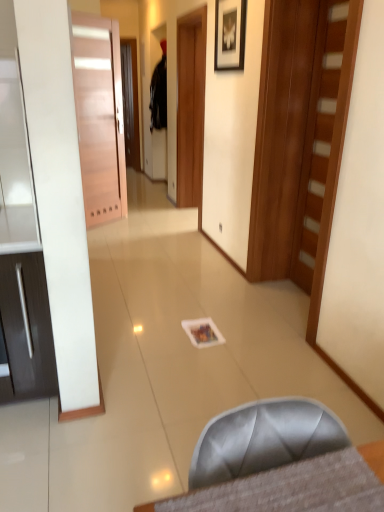
Locate an element on the screen. The width and height of the screenshot is (384, 512). matte pink door at left, placed as the 2th door when sorted from right to left is located at coordinates (99, 116).

Find the location of a particular element. wooden door at right, which is the second door in left-to-right order is located at coordinates point(324,131).

You are a GUI agent. You are given a task and a screenshot of the screen. Output one action in this format:
    pyautogui.click(x=<x>, y=<y>)
    Task: Click on the black fabric robe at upper center
    Image resolution: width=384 pixels, height=512 pixels.
    Given the screenshot: What is the action you would take?
    pyautogui.click(x=159, y=95)

Which is in front, point (244, 13) or point (163, 71)?

The point (244, 13) is more forward.

Is matte black picture frame at upper center in contact with black fabric robe at upper center?

No.

From the picture: Can you confirm if matte black picture frame at upper center is bigger than black fabric robe at upper center?

No.

Between matte black picture frame at upper center and black fabric robe at upper center, which one has smaller width?

matte black picture frame at upper center is thinner.

Looking at this image, from the image's perspective, between matte black picture frame at upper center and matte pink door at left, marked as the 1th door in a left-to-right arrangement, who is located below?

matte pink door at left, marked as the 1th door in a left-to-right arrangement, from the image's perspective.

Is matte black picture frame at upper center outside of matte pink door at left, marked as the 1th door in a left-to-right arrangement?

Yes.

Based on their positions, is matte black picture frame at upper center located to the left or right of matte pink door at left, which appears as the second door when viewed from the front?

matte black picture frame at upper center is to the right of matte pink door at left, which appears as the second door when viewed from the front.

Does point (227, 35) appear closer or farther from the camera than point (116, 217)?

Point (227, 35).

Is black fabric robe at upper center thinner than satin gray chair at lower center?

Indeed, black fabric robe at upper center has a lesser width compared to satin gray chair at lower center.

Find the location of a particular element. This screenshot has width=384, height=512. furniture below the black fabric robe at upper center (from a real-world perspective) is located at coordinates (263, 439).

Based on their sizes in the image, would you say black fabric robe at upper center is bigger or smaller than satin gray chair at lower center?

Considering their sizes, black fabric robe at upper center takes up more space than satin gray chair at lower center.

Does satin gray chair at lower center turn towards matte pink door at left, which appears as the second door when viewed from the front?

No, satin gray chair at lower center does not turn towards matte pink door at left, which appears as the second door when viewed from the front.

Is satin gray chair at lower center at the right side of matte pink door at left, placed as the 2th door when sorted from right to left?

Indeed, satin gray chair at lower center is positioned on the right side of matte pink door at left, placed as the 2th door when sorted from right to left.

The image size is (384, 512). What are the coordinates of `the 2nd door positioned above the satin gray chair at lower center (from a real-world perspective)` in the screenshot? It's located at (99, 116).

Is satin gray chair at lower center wider than matte pink door at left, placed as the 2th door when sorted from right to left?

Correct, the width of satin gray chair at lower center exceeds that of matte pink door at left, placed as the 2th door when sorted from right to left.

Considering the sizes of objects wooden door at right, which appears as the second door when viewed from the back, and black fabric robe at upper center in the image provided, who is shorter, wooden door at right, which appears as the second door when viewed from the back, or black fabric robe at upper center?

Standing shorter between the two is black fabric robe at upper center.

Find the location of a particular element. robe that appears above the wooden door at right, which appears as the second door when viewed from the back (from the image's perspective) is located at coordinates (159, 95).

From the image's perspective, between wooden door at right, positioned as the first door in right-to-left order, and black fabric robe at upper center, who is located below?

From the image's view, wooden door at right, positioned as the first door in right-to-left order, is below.

Can you confirm if wooden door at right, positioned as the first door in right-to-left order, is thinner than black fabric robe at upper center?

Correct, the width of wooden door at right, positioned as the first door in right-to-left order, is less than that of black fabric robe at upper center.

Between black fabric robe at upper center and wooden door at right, the 1th door when ordered from front to back, which one has more height?

With more height is wooden door at right, the 1th door when ordered from front to back.

Starting from the black fabric robe at upper center, which door is the 2nd one in front? Please provide its 2D coordinates.

[(324, 131)]

From a real-world perspective, between black fabric robe at upper center and wooden door at right, the 1th door when ordered from front to back, who is vertically higher?

black fabric robe at upper center is physically above.

Is point (155, 75) in front of point (310, 111)?

No, it is not.

Considering the positions of points (254, 420) and (316, 170), is point (254, 420) closer to camera compared to point (316, 170)?

Yes, point (254, 420) is in front of point (316, 170).

Is satin gray chair at lower center next to wooden door at right, which appears as the second door when viewed from the back, and touching it?

No, satin gray chair at lower center is not beside wooden door at right, which appears as the second door when viewed from the back.

From the image's perspective, which one is positioned higher, satin gray chair at lower center or wooden door at right, positioned as the first door in right-to-left order?

wooden door at right, positioned as the first door in right-to-left order.

Does satin gray chair at lower center have a lesser height compared to wooden door at right, which appears as the second door when viewed from the back?

Indeed, satin gray chair at lower center has a lesser height compared to wooden door at right, which appears as the second door when viewed from the back.

In order to click on picture frame above the black fabric robe at upper center (from a real-world perspective) in this screenshot , I will do `click(230, 34)`.

This screenshot has height=512, width=384. I want to click on picture frame in front of the matte pink door at left, placed as the 2th door when sorted from right to left, so click(x=230, y=34).

Estimate the real-world distances between objects in this image. Which object is further from wooden door at right, the 1th door when ordered from front to back, black fabric robe at upper center or matte pink door at left, which appears as the second door when viewed from the front?

black fabric robe at upper center is further to wooden door at right, the 1th door when ordered from front to back.

Looking at this image, estimate the real-world distances between objects in this image. Which object is closer to matte pink door at left, placed as the 2th door when sorted from right to left, black fabric robe at upper center or matte black picture frame at upper center?

The object closer to matte pink door at left, placed as the 2th door when sorted from right to left, is black fabric robe at upper center.

When comparing their distances from wooden door at right, which is the second door in left-to-right order, does satin gray chair at lower center or matte black picture frame at upper center seem closer?

matte black picture frame at upper center lies closer to wooden door at right, which is the second door in left-to-right order, than the other object.

When comparing their distances from matte pink door at left, placed as the 2th door when sorted from right to left, does matte black picture frame at upper center or wooden door at right, which is the second door in left-to-right order, seem further?

wooden door at right, which is the second door in left-to-right order, is further to matte pink door at left, placed as the 2th door when sorted from right to left.

From the image, which object appears to be nearer to matte black picture frame at upper center, matte pink door at left, marked as the 1th door in a left-to-right arrangement, or satin gray chair at lower center?

matte pink door at left, marked as the 1th door in a left-to-right arrangement, lies closer to matte black picture frame at upper center than the other object.

Estimate the real-world distances between objects in this image. Which object is further from satin gray chair at lower center, matte pink door at left, which is the first door in back-to-front order, or wooden door at right, which appears as the second door when viewed from the back?

matte pink door at left, which is the first door in back-to-front order, lies further to satin gray chair at lower center than the other object.

Which object lies further to the anchor point wooden door at right, positioned as the first door in right-to-left order, matte pink door at left, marked as the 1th door in a left-to-right arrangement, or satin gray chair at lower center?

The object further to wooden door at right, positioned as the first door in right-to-left order, is matte pink door at left, marked as the 1th door in a left-to-right arrangement.

From the image, which object appears to be farther from matte black picture frame at upper center, satin gray chair at lower center or wooden door at right, positioned as the first door in right-to-left order?

The object further to matte black picture frame at upper center is satin gray chair at lower center.

This screenshot has height=512, width=384. I want to click on door between wooden door at right, which is the second door in left-to-right order, and black fabric robe at upper center in the front-back direction, so click(x=99, y=116).

Locate an element on the screen. The width and height of the screenshot is (384, 512). door positioned between satin gray chair at lower center and matte pink door at left, which appears as the second door when viewed from the front, from near to far is located at coordinates (324, 131).

Find the location of a particular element. door located between matte black picture frame at upper center and black fabric robe at upper center in the depth direction is located at coordinates (99, 116).

What are the coordinates of `picture frame positioned between satin gray chair at lower center and matte pink door at left, marked as the 1th door in a left-to-right arrangement, from near to far` in the screenshot? It's located at (230, 34).